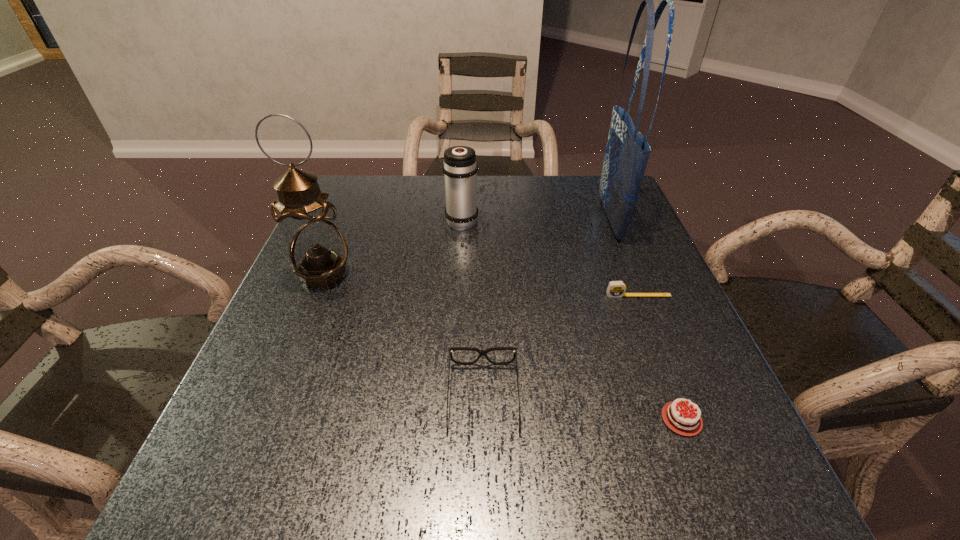
At what (x,y) coordinates should I click in order to perform the action: click on tape measure that is at the right edge. Please return your answer as a coordinate pair (x, y). Looking at the image, I should click on (616, 289).

I want to click on chocolate cake located in the right edge section of the desktop, so click(687, 422).

At what (x,y) coordinates should I click in order to perform the action: click on object that is at the far right corner. Please return your answer as a coordinate pair (x, y). The height and width of the screenshot is (540, 960). Looking at the image, I should click on (627, 151).

Locate an element on the screen. This screenshot has height=540, width=960. object that is positioned at the near right corner is located at coordinates (687, 422).

Where is `free location at the far edge of the desktop`? This screenshot has width=960, height=540. free location at the far edge of the desktop is located at coordinates (549, 206).

Where is `free spot at the near edge of the desktop`? The width and height of the screenshot is (960, 540). free spot at the near edge of the desktop is located at coordinates (500, 465).

Locate an element on the screen. The image size is (960, 540). vacant space at the left edge is located at coordinates (301, 390).

Locate an element on the screen. This screenshot has height=540, width=960. free space at the right edge of the desktop is located at coordinates (611, 246).

This screenshot has height=540, width=960. What are the coordinates of `free space at the far left corner of the desktop` in the screenshot? It's located at tap(372, 181).

At what (x,y) coordinates should I click in order to perform the action: click on vacant space at the far right corner of the desktop. Please return your answer as a coordinate pair (x, y). The image size is (960, 540). Looking at the image, I should click on (568, 178).